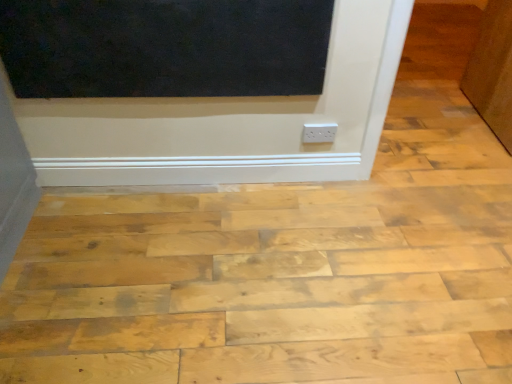
You are a GUI agent. You are given a task and a screenshot of the screen. Output one action in this format:
    pyautogui.click(x=<x>, y=<y>)
    Task: Click on the vacant space that is to the left of brown matte door at upper right
    
    Given the screenshot: What is the action you would take?
    pyautogui.click(x=425, y=121)